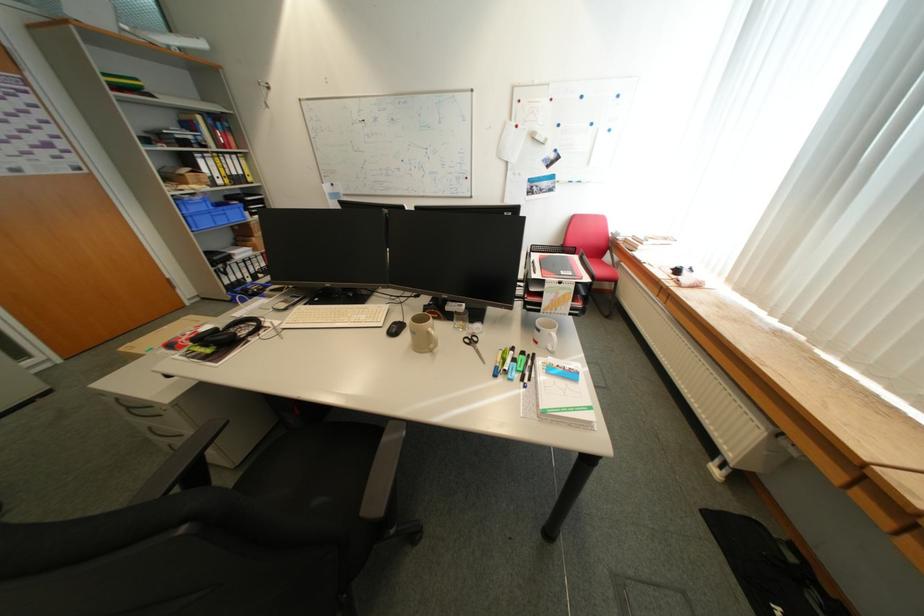
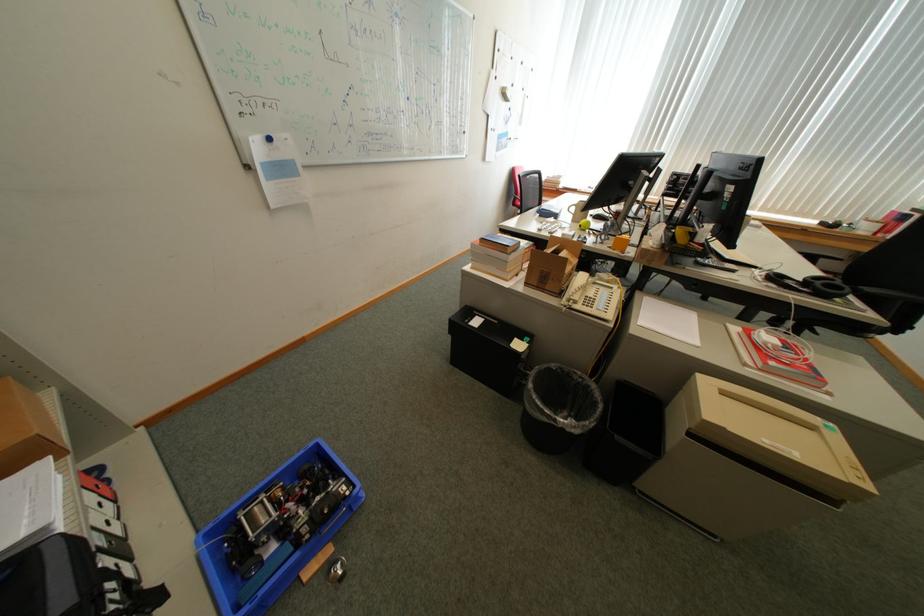
Question: I am providing you with two images of the same scene from different viewpoints. Please identify which objects are invisible in image2.

Choices:
 (A) pink cushioned surface
 (B) beige printer lid
 (C) chair armrest
 (D) green marker

Answer: (D)